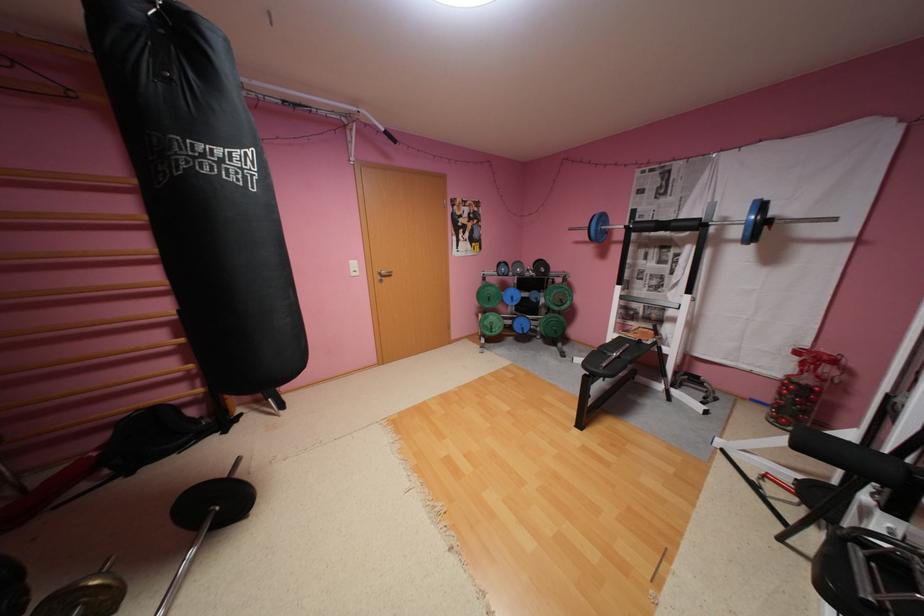
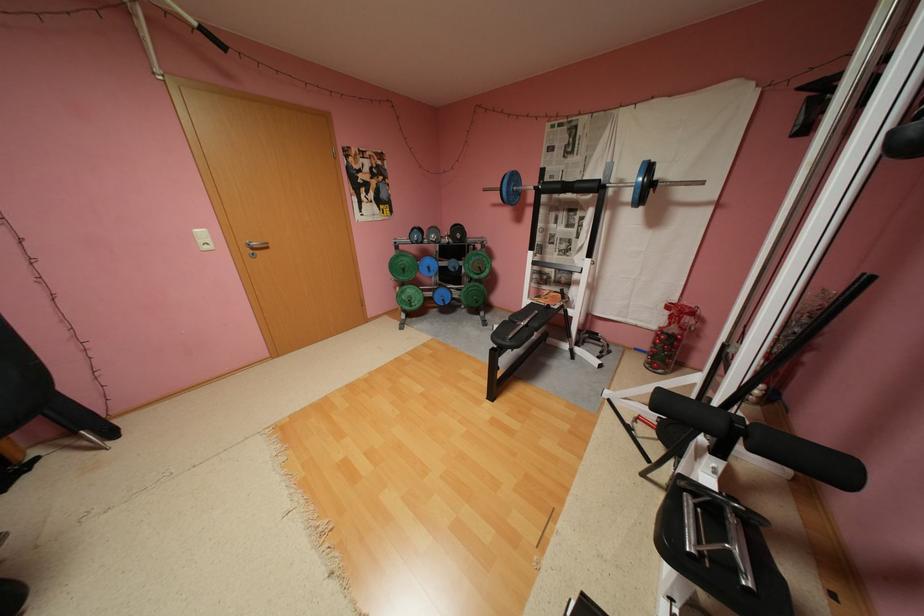
The point at (x=543, y=336) is marked in the first image. Where is the corresponding point in the second image?

(468, 306)